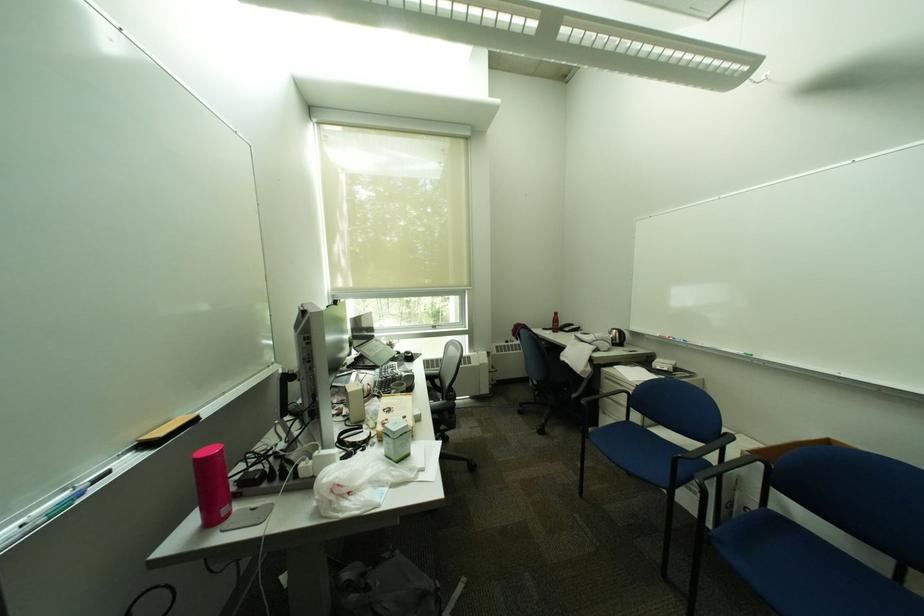
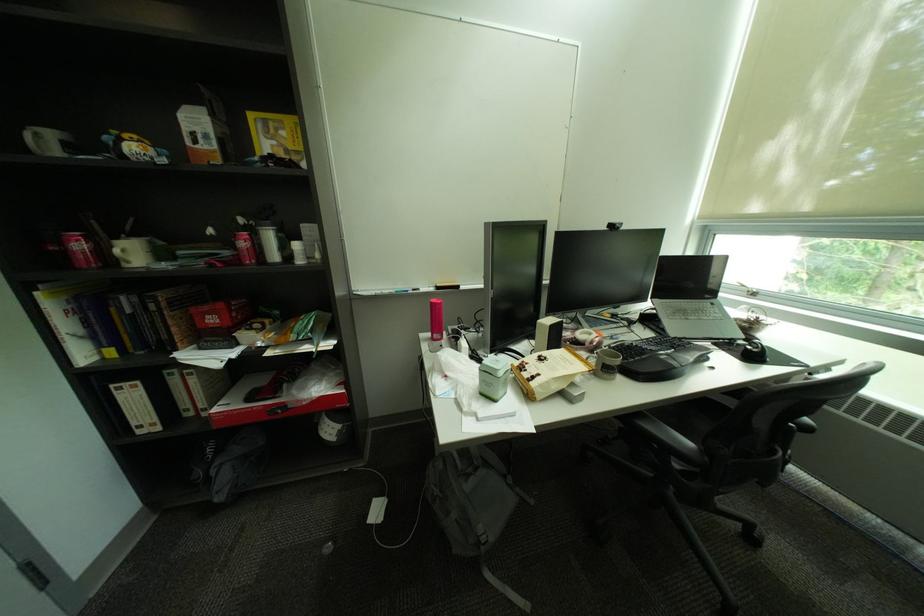
Locate, in the second image, the point that corresponds to (408,464) in the first image.

(492, 395)